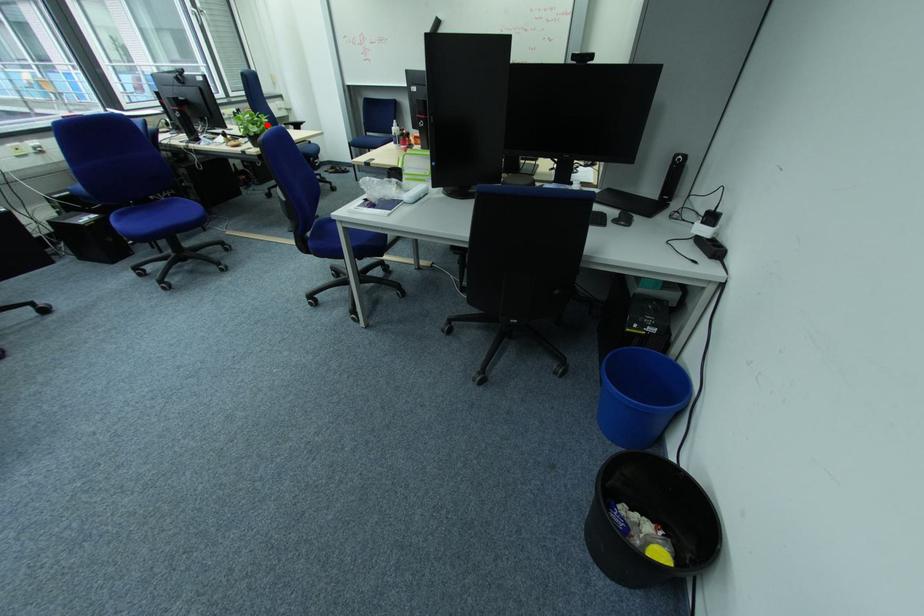
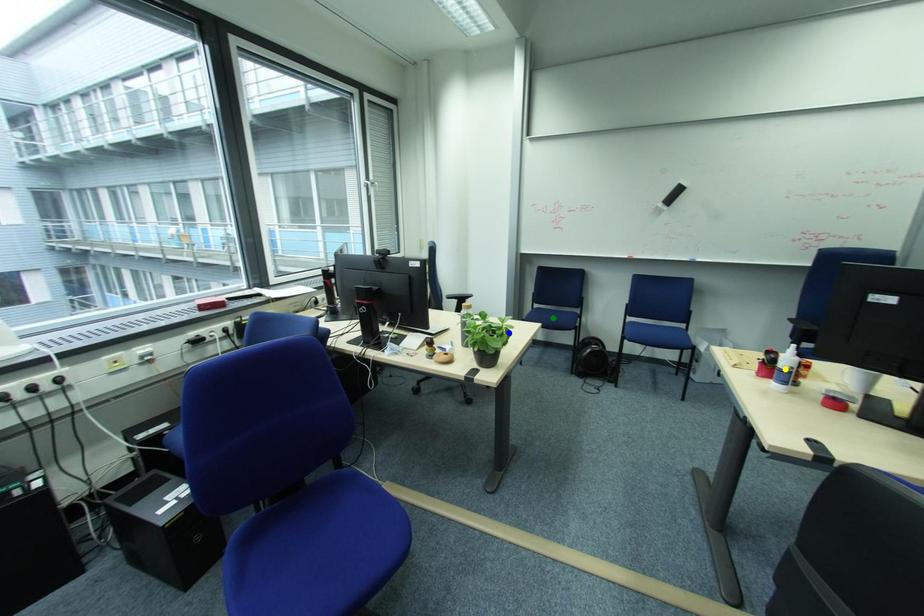
Question: I am providing you with two images of the same scene from different viewpoints. A red point is marked on the first image. You are given multiple points on the second image. Can you choose the point in image 2 that corresponds to the point in image 1?

Choices:
 (A) yellow point
 (B) blue point
 (C) green point

Answer: (B)